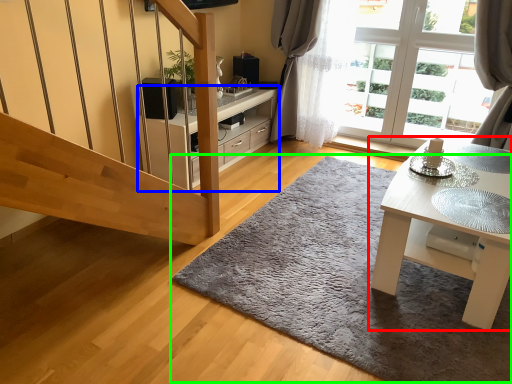
Question: Considering the real-world distances, which object is closest to table (highlighted by a red box)? cabinetry (highlighted by a blue box) or doormat (highlighted by a green box).

Choices:
 (A) cabinetry
 (B) doormat

Answer: (B)